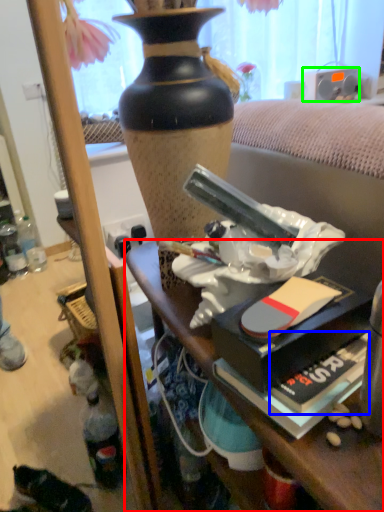
Question: Considering the real-world distances, which object is farthest from desk (highlighted by a red box)? paperback book (highlighted by a blue box) or loudspeaker (highlighted by a green box)?

Choices:
 (A) paperback book
 (B) loudspeaker

Answer: (B)